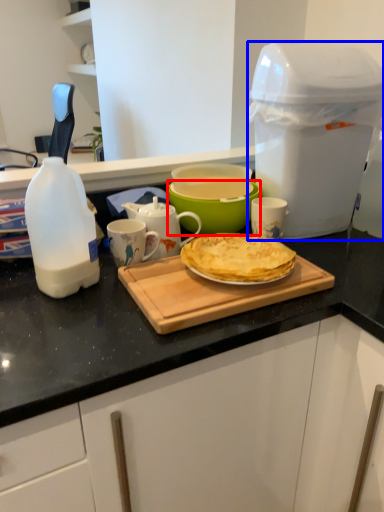
Question: Which object is closer to the camera taking this photo, bowl (highlighted by a red box) or appliance (highlighted by a blue box)?

Choices:
 (A) bowl
 (B) appliance

Answer: (B)